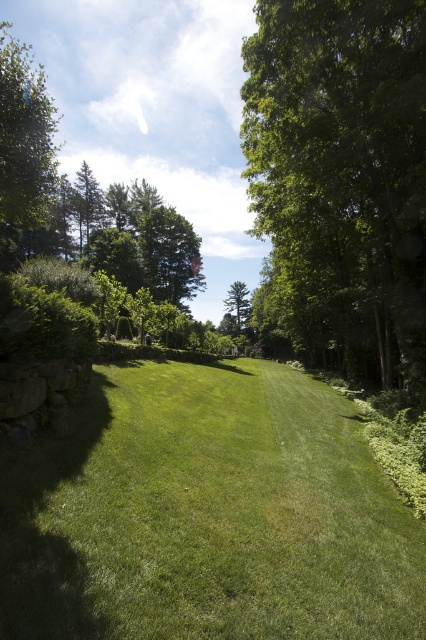
Is green grassy at lower left in front of green leafy tree at center?

That is True.

Where is `green grassy at lower left`? Image resolution: width=426 pixels, height=640 pixels. green grassy at lower left is located at coordinates (207, 515).

In the scene shown: Is green leafy tree at center behind green leafy tree at upper left?

Yes.

Based on the photo, who is higher up, green leafy tree at center or green leafy tree at upper left?

green leafy tree at upper left is higher up.

The width and height of the screenshot is (426, 640). Find the location of `green leafy tree at center`. green leafy tree at center is located at coordinates (340, 179).

Where is `green leafy tree at center`? The width and height of the screenshot is (426, 640). green leafy tree at center is located at coordinates (340, 179).

Is green grassy at lower left closer to camera compared to green leafy tree at upper left?

Yes.

Is green grassy at lower left to the left of green leafy tree at upper left from the viewer's perspective?

In fact, green grassy at lower left is to the right of green leafy tree at upper left.

What do you see at coordinates (207, 515) in the screenshot? I see `green grassy at lower left` at bounding box center [207, 515].

Identify the location of green grassy at lower left. The image size is (426, 640). (207, 515).